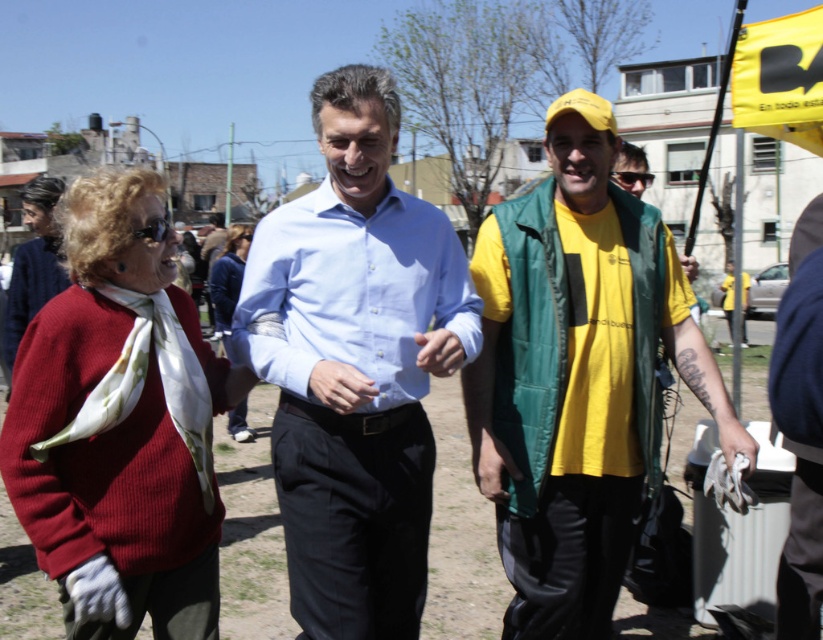
You are a GUI agent. You are given a task and a screenshot of the screen. Output one action in this format:
    pyautogui.click(x=<x>, y=<y>)
    Task: Click on the yellow matte t-shirt at center
    The height and width of the screenshot is (640, 823).
    Given the screenshot: What is the action you would take?
    pyautogui.click(x=577, y=376)

Does yellow matte t-shirt at center appear on the right side of matte red sweater at left?

Indeed, yellow matte t-shirt at center is positioned on the right side of matte red sweater at left.

Is point (529, 266) positioned in front of point (129, 582)?

No, (529, 266) is behind (129, 582).

Image resolution: width=823 pixels, height=640 pixels. In order to click on yellow matte t-shirt at center in this screenshot , I will do `click(577, 376)`.

Can you confirm if yellow fabric flag at upper right is thinner than matte white scarf at center?

Yes.

Is point (744, 29) positioned before point (231, 410)?

Yes, it is in front of point (231, 410).

In order to click on yellow fabric flag at upper right in this screenshot , I will do `click(780, 77)`.

Where is `yellow fabric flag at upper right`? The width and height of the screenshot is (823, 640). yellow fabric flag at upper right is located at coordinates (780, 77).

Is light blue shirt at center below matte white scarf at center?

Yes.

Does point (375, 579) come farther from viewer compared to point (236, 426)?

No, (375, 579) is in front of (236, 426).

Where is `light blue shirt at center`? light blue shirt at center is located at coordinates (356, 365).